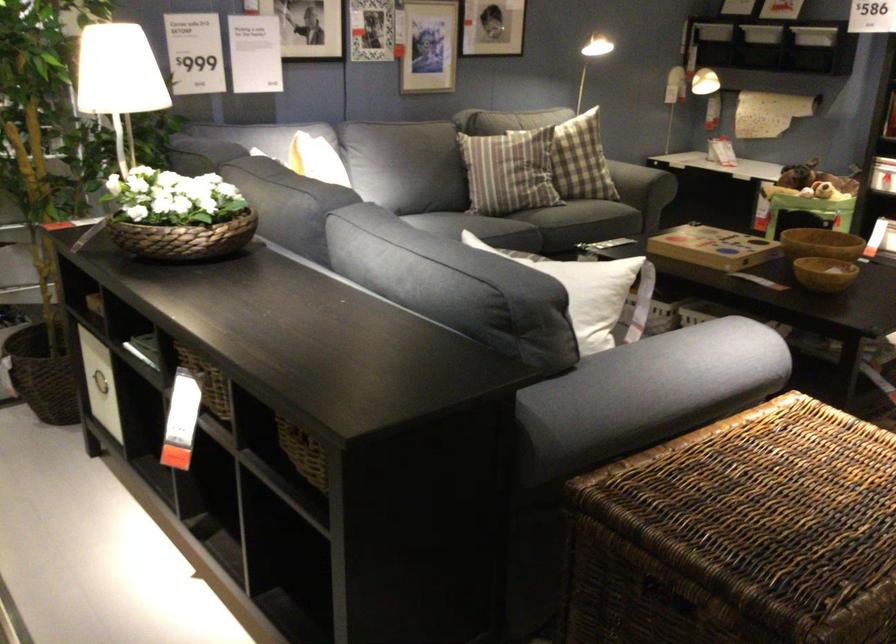
This screenshot has height=644, width=896. Describe the element at coordinates (776, 509) in the screenshot. I see `the wicker storage basket` at that location.